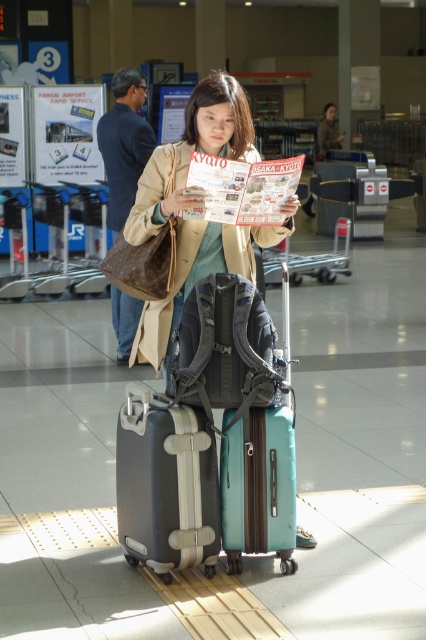
Between teal matte suitcase at center and printed paper magazine at center, which one has more height?

Standing taller between the two is teal matte suitcase at center.

Does point (290, 515) lie in front of point (241, 218)?

Yes.

Does point (284, 406) come behind point (201, 193)?

That is True.

Where is `teal matte suitcase at center`? teal matte suitcase at center is located at coordinates (258, 484).

Between matte beige coat at center and teal matte suitcase at center, which one has more height?

matte beige coat at center is taller.

Can you confirm if matte beige coat at center is smaller than teal matte suitcase at center?

No.

The width and height of the screenshot is (426, 640). Describe the element at coordinates (190, 152) in the screenshot. I see `matte beige coat at center` at that location.

Where is `matte beige coat at center`? matte beige coat at center is located at coordinates (190, 152).

Who is shorter, matte black suitcase at center or teal matte suitcase at center?

teal matte suitcase at center

Can you confirm if matte black suitcase at center is smaller than teal matte suitcase at center?

Actually, matte black suitcase at center might be larger than teal matte suitcase at center.

Find the location of a particular element. The image size is (426, 640). matte black suitcase at center is located at coordinates (166, 484).